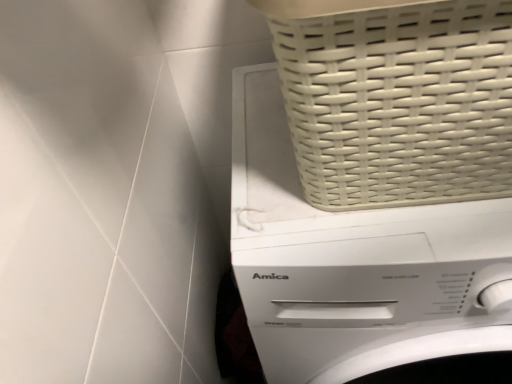
Question: Does white woven basket at upper right have a larger size compared to white plastic washing machine at upper right?

Choices:
 (A) no
 (B) yes

Answer: (A)

Question: Is white woven basket at upper right positioned beyond the bounds of white plastic washing machine at upper right?

Choices:
 (A) yes
 (B) no

Answer: (A)

Question: Is white plastic washing machine at upper right surrounded by white woven basket at upper right?

Choices:
 (A) yes
 (B) no

Answer: (B)

Question: From a real-world perspective, is white woven basket at upper right located higher than white plastic washing machine at upper right?

Choices:
 (A) no
 (B) yes

Answer: (B)

Question: Is white woven basket at upper right in contact with white plastic washing machine at upper right?

Choices:
 (A) yes
 (B) no

Answer: (B)

Question: Could you tell me if white woven basket at upper right is facing white plastic washing machine at upper right?

Choices:
 (A) yes
 (B) no

Answer: (B)

Question: From a real-world perspective, is white plastic washing machine at upper right over white woven basket at upper right?

Choices:
 (A) no
 (B) yes

Answer: (A)

Question: Would you say white plastic washing machine at upper right is outside white woven basket at upper right?

Choices:
 (A) no
 (B) yes

Answer: (B)

Question: Is white plastic washing machine at upper right smaller than white woven basket at upper right?

Choices:
 (A) no
 (B) yes

Answer: (A)

Question: From the image's perspective, is white plastic washing machine at upper right under white woven basket at upper right?

Choices:
 (A) yes
 (B) no

Answer: (A)

Question: Is white plastic washing machine at upper right taller than white woven basket at upper right?

Choices:
 (A) no
 (B) yes

Answer: (B)

Question: Is white plastic washing machine at upper right bigger than white woven basket at upper right?

Choices:
 (A) yes
 (B) no

Answer: (A)

Question: Considering the positions of white plastic washing machine at upper right and white woven basket at upper right in the image, is white plastic washing machine at upper right wider or thinner than white woven basket at upper right?

Choices:
 (A) wide
 (B) thin

Answer: (A)